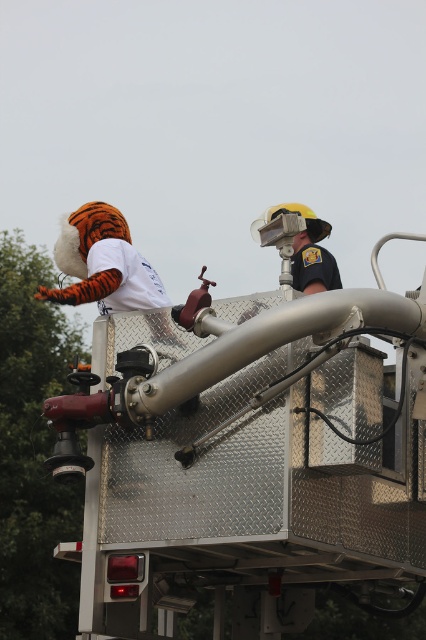
Based on the photo, you are a firefighter on the platform of a fire truck. You need to retrieve an object that is closer to you. Which one should you choose between the orange plush tiger at upper left and the matte black helmet at upper center?

The orange plush tiger at upper left is closer to the viewer than the matte black helmet at upper center, so you should choose the orange plush tiger at upper left.

You are a firefighter on the fire truck platform. You need to reach the orange plush tiger at upper left to retrieve it. What are the coordinates where you should look?

The orange plush tiger at upper left is located at coordinates point (109,269).

Based on the photo, you are a firefighter on the platform of a fire truck. You need to place a new helmet on the platform. The platform has limited space. Which object, the orange plush tiger at upper left or the matte black helmet at upper center, should you move to make space for the new helmet?

The orange plush tiger at upper left has a greater height compared to the matte black helmet at upper center, so moving the orange plush tiger at upper left would free up more space for the new helmet.